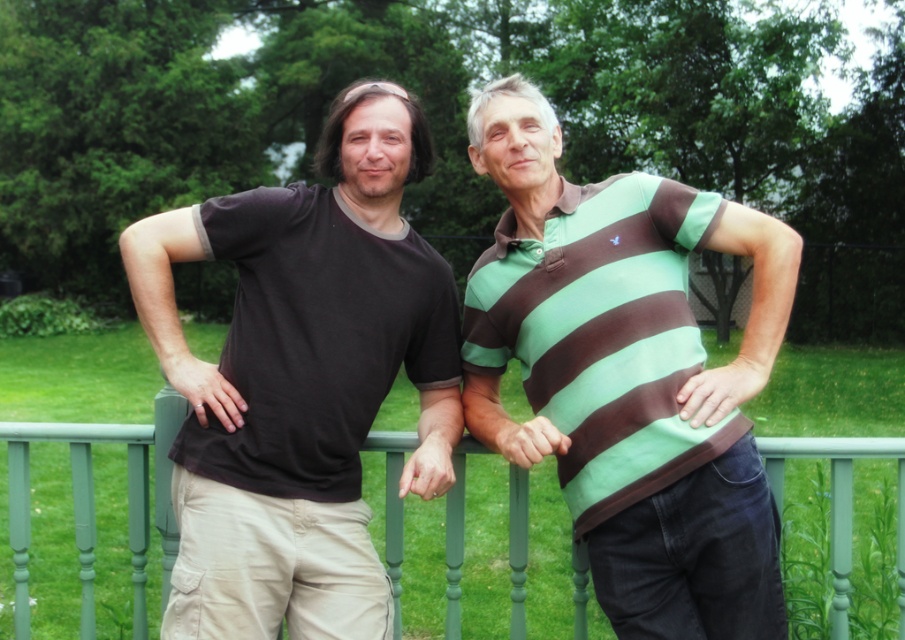
You are a photographer taking a picture of the two people on the balcony. You notice two points in the image labeled as point 1 and point 2. Point 1 has coordinates point [335,545] and point 2 has coordinates point [156,524]. Which point is closer to the camera?

Point [335,545] is closer to the camera than point [156,524].